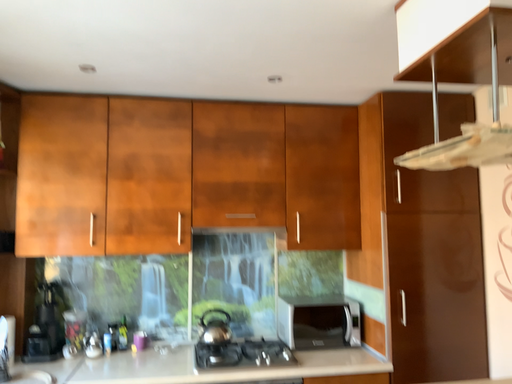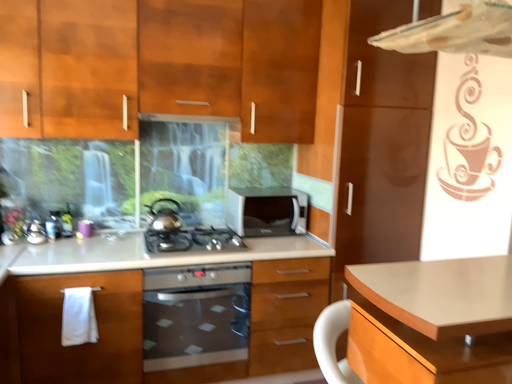
Question: How did the camera likely rotate when shooting the video?

Choices:
 (A) rotated downward
 (B) rotated upward

Answer: (A)